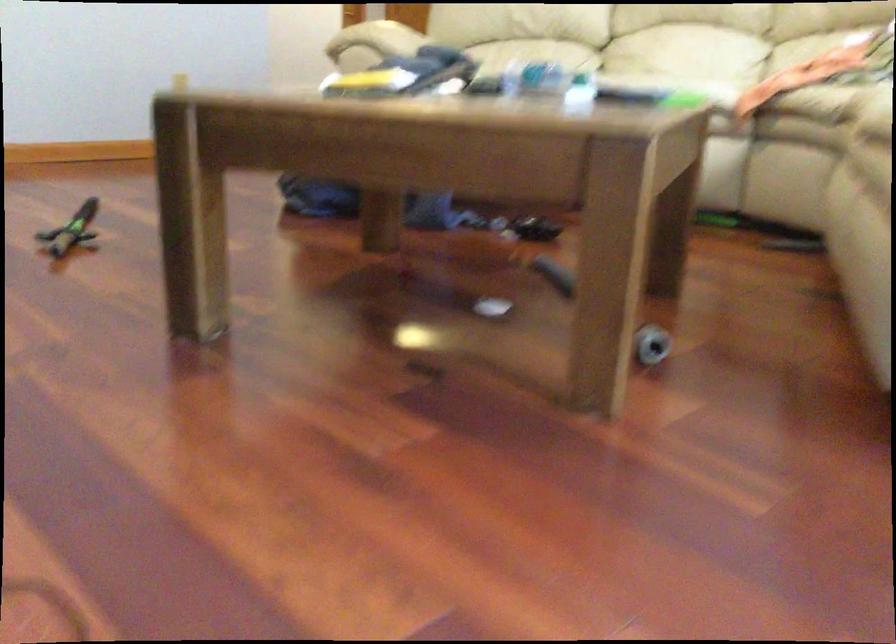
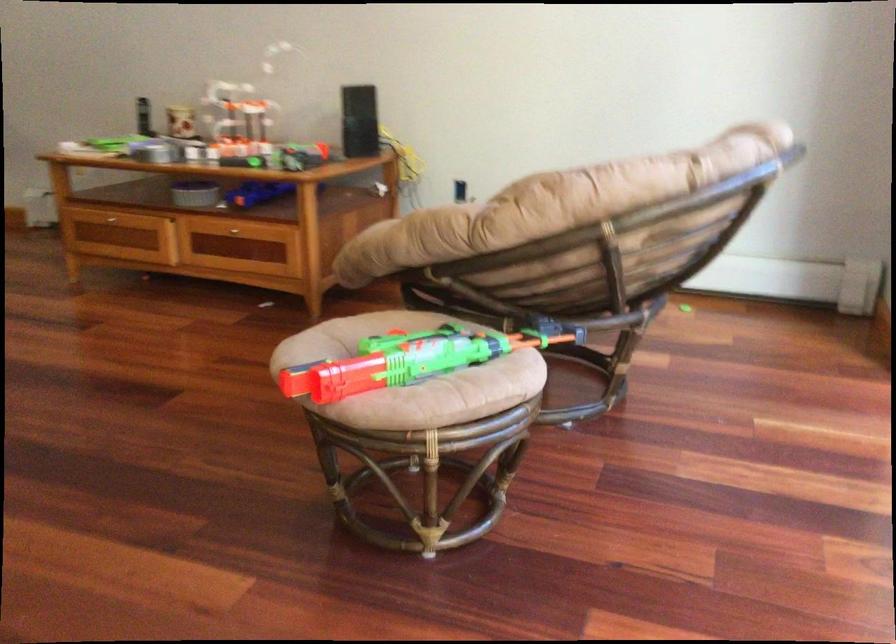
What movement of the cameraman would produce the second image?

The cameraman moved toward right, forward.